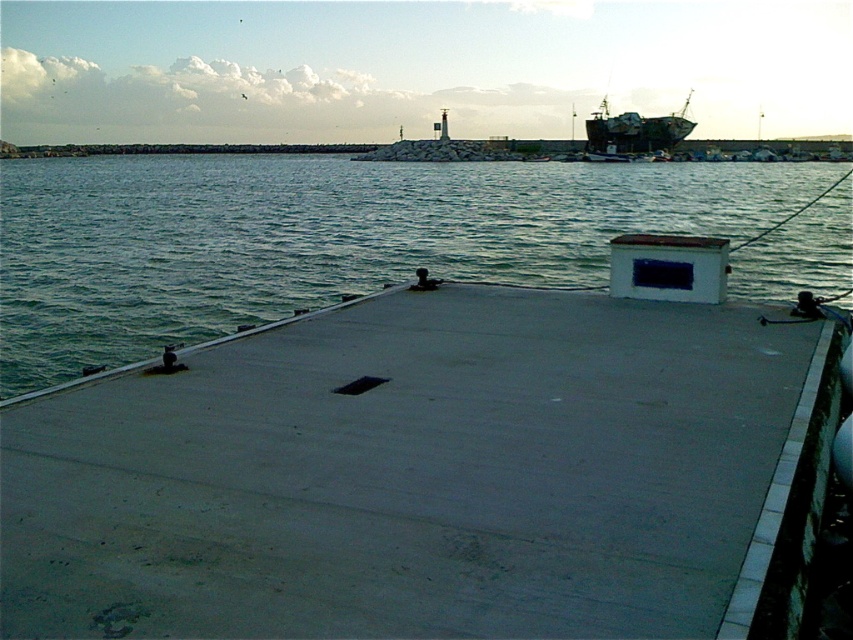
You are a delivery drone with a maximum flight range of 90 meters. You need to deliver a package from the gray concrete dock at center to the metallic gray ship at upper right. Can you complete the delivery without needing a recharge?

The gray concrete dock at center is 92.22 meters from the metallic gray ship at upper right, so the drone cannot complete the delivery without needing a recharge since the distance exceeds its maximum flight range of 90 meters.

You are standing on the dock and want to reach the point marked at coordinates point (494, 237). If your walking speed is 3 feet per second, how many seconds will it take you to reach that point?

The distance between you and the point (494, 237) is 71.92 feet. At a walking speed of 3 feet per second, it would take approximately 23.97 seconds to reach the point. Since we typically round to the nearest whole number, it would take about 24 seconds.

You are standing on the dock and want to reach the point at coordinates (x=186, y=572). If your walking speed is 1.2 meters per second, how many seconds will it take you to reach that point?

The distance between you and the point at coordinates (x=186, y=572) is 3.64 meters. At a walking speed of 1.2 meters per second, it will take approximately 3.03 seconds to reach the point.